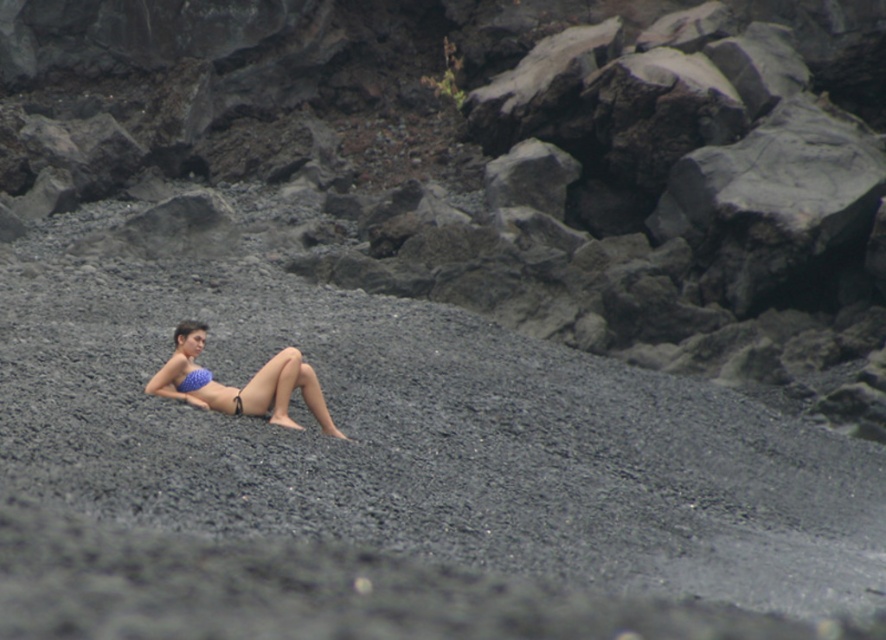
You are a photographer trying to capture the blue bikini top at center and the gray gravel at center in a single shot. Based on their positions, which object will appear closer to the camera in the photo?

The gray gravel at center appears closer to the camera because it has a greater height compared to the blue bikini top at center, making it stand out more in the foreground.

You are a photographer trying to capture a closeup of the gray gravel at center and the smooth gray rock at center. Since you want to focus on the gravel, which object should you place closer to the camera lens?

The gray gravel at center has a lesser height compared to the smooth gray rock at center, so to focus on the gravel, you should place the gray gravel at center closer to the camera lens.